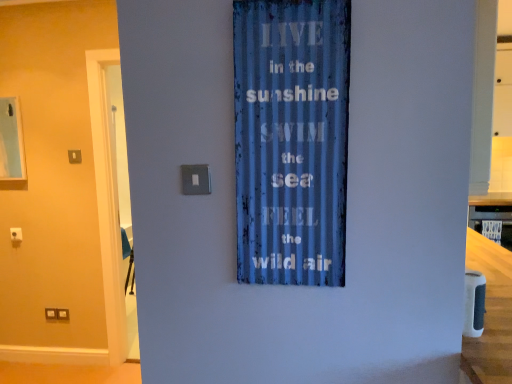
Question: Is satin silver switch at center, placed as the 2th light switch when sorted from top to bottom, facing away from smooth wooden counter top at right?

Choices:
 (A) no
 (B) yes

Answer: (A)

Question: Is satin silver switch at center, positioned as the 2th light switch in left-to-right order, further to camera compared to smooth wooden counter top at right?

Choices:
 (A) yes
 (B) no

Answer: (B)

Question: Can you confirm if satin silver switch at center, which is the first light switch from right to left, is smaller than smooth wooden counter top at right?

Choices:
 (A) no
 (B) yes

Answer: (B)

Question: From the image's perspective, is satin silver switch at center, the 1th light switch viewed from the front, below smooth wooden counter top at right?

Choices:
 (A) yes
 (B) no

Answer: (B)

Question: Does satin silver switch at center, placed as the 2th light switch when sorted from top to bottom, contain smooth wooden counter top at right?

Choices:
 (A) yes
 (B) no

Answer: (B)

Question: From the image's perspective, is satin silver switch at upper center, acting as the first light switch starting from the left, located above or below smooth wooden counter top at right?

Choices:
 (A) above
 (B) below

Answer: (A)

Question: Considering the relative positions of satin silver switch at upper center, marked as the 2th light switch in a front-to-back arrangement, and smooth wooden counter top at right in the image provided, is satin silver switch at upper center, marked as the 2th light switch in a front-to-back arrangement, to the left or to the right of smooth wooden counter top at right?

Choices:
 (A) left
 (B) right

Answer: (A)

Question: Based on their sizes in the image, would you say satin silver switch at upper center, the first light switch viewed from the back, is bigger or smaller than smooth wooden counter top at right?

Choices:
 (A) small
 (B) big

Answer: (A)

Question: Considering the positions of satin silver switch at upper center, the first light switch viewed from the back, and smooth wooden counter top at right in the image, is satin silver switch at upper center, the first light switch viewed from the back, wider or thinner than smooth wooden counter top at right?

Choices:
 (A) wide
 (B) thin

Answer: (B)

Question: Looking at their shapes, would you say satin silver switch at center, positioned as the 2th light switch in left-to-right order, is wider or thinner than blue corrugated metal sign at center?

Choices:
 (A) wide
 (B) thin

Answer: (B)

Question: Is point (207, 192) closer or farther from the camera than point (273, 79)?

Choices:
 (A) closer
 (B) farther

Answer: (B)

Question: Relative to blue corrugated metal sign at center, is satin silver switch at center, positioned as the 2th light switch in left-to-right order, in front or behind?

Choices:
 (A) behind
 (B) front

Answer: (A)

Question: Is satin silver switch at center, which is counted as the 1th light switch, starting from the bottom, bigger or smaller than blue corrugated metal sign at center?

Choices:
 (A) small
 (B) big

Answer: (A)

Question: From a real-world perspective, is satin silver switch at center, which is the first light switch from right to left, above or below satin silver switch at upper center, the first light switch viewed from the back?

Choices:
 (A) below
 (B) above

Answer: (A)

Question: In the image, is satin silver switch at center, which is counted as the 1th light switch, starting from the bottom, positioned in front of or behind satin silver switch at upper center, which ranks as the 2th light switch in right-to-left order?

Choices:
 (A) behind
 (B) front

Answer: (B)